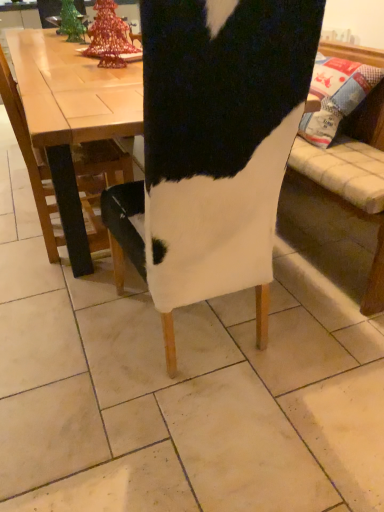
The image size is (384, 512). I want to click on vacant area that lies to the right of white fabric chair at center, the second chair viewed from the left, so click(x=313, y=323).